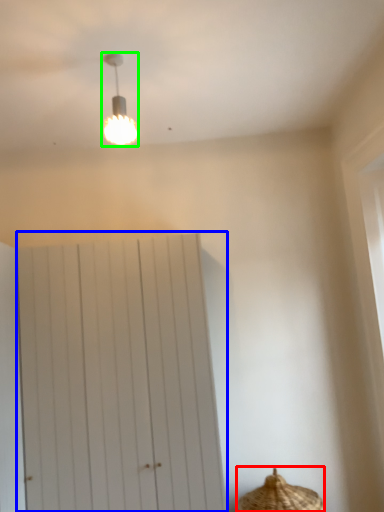
Question: Which is nearer to the basket (highlighted by a red box)? barn door (highlighted by a blue box) or lamp (highlighted by a green box).

Choices:
 (A) barn door
 (B) lamp

Answer: (A)